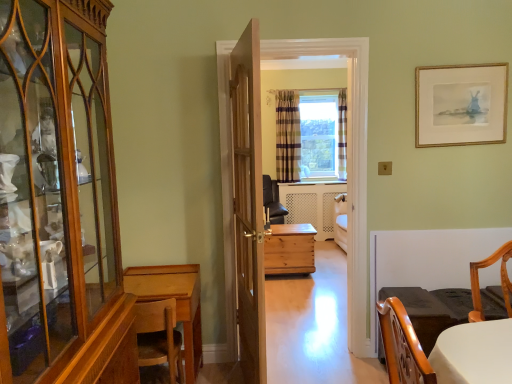
Question: Is natural wood chest at center, which appears as the 2th desk when viewed from the front, taller than white glossy table at lower right?

Choices:
 (A) yes
 (B) no

Answer: (A)

Question: Could white glossy table at lower right be considered to be inside natural wood chest at center, which appears as the second desk when viewed from the left?

Choices:
 (A) no
 (B) yes

Answer: (A)

Question: Does natural wood chest at center, which appears as the second desk when viewed from the left, appear on the right side of white glossy table at lower right?

Choices:
 (A) yes
 (B) no

Answer: (B)

Question: From the image's perspective, is natural wood chest at center, which appears as the second desk when viewed from the left, on top of white glossy table at lower right?

Choices:
 (A) no
 (B) yes

Answer: (B)

Question: Is the depth of natural wood chest at center, acting as the first desk starting from the right, less than that of white glossy table at lower right?

Choices:
 (A) yes
 (B) no

Answer: (B)

Question: Is natural wood chest at center, acting as the first desk starting from the right, at the left side of white glossy table at lower right?

Choices:
 (A) no
 (B) yes

Answer: (B)

Question: Considering the relative sizes of wooden chest at center and wooden door at center in the image provided, is wooden chest at center bigger than wooden door at center?

Choices:
 (A) no
 (B) yes

Answer: (B)

Question: From a real-world perspective, is wooden chest at center positioned under wooden door at center based on gravity?

Choices:
 (A) yes
 (B) no

Answer: (B)

Question: Is there a large distance between wooden chest at center and wooden door at center?

Choices:
 (A) yes
 (B) no

Answer: (B)

Question: Can you confirm if wooden chest at center is taller than wooden door at center?

Choices:
 (A) yes
 (B) no

Answer: (A)

Question: Is wooden chest at center wider than wooden door at center?

Choices:
 (A) yes
 (B) no

Answer: (A)

Question: Could you tell me if wooden chest at center is turned towards wooden door at center?

Choices:
 (A) no
 (B) yes

Answer: (B)

Question: Can you confirm if wooden cabinet at left is positioned to the left of wooden chest at center?

Choices:
 (A) no
 (B) yes

Answer: (B)